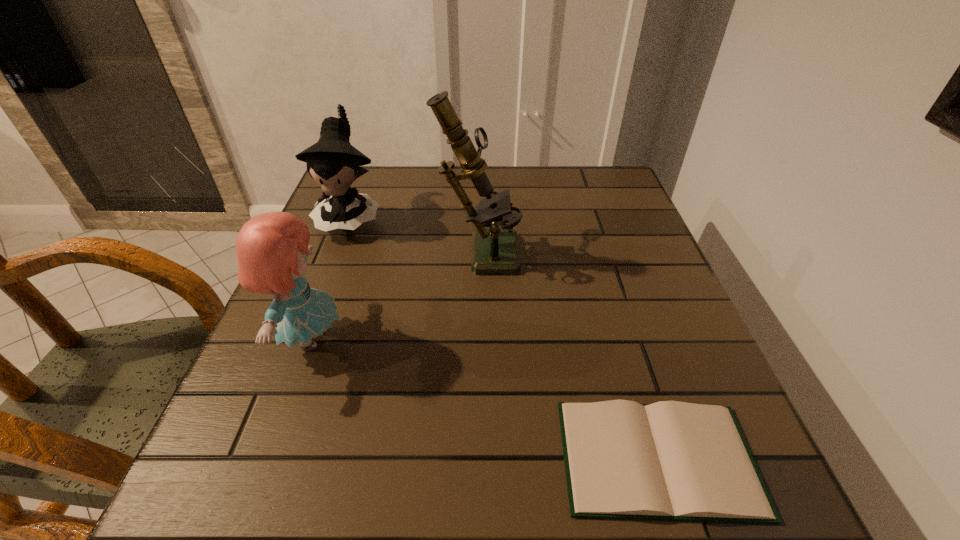
Identify the location of vacant space at the far right corner of the desktop. (582, 186).

The width and height of the screenshot is (960, 540). I want to click on free spot between the farther doll and the second object from right to left, so click(415, 233).

The image size is (960, 540). I want to click on vacant area that lies between the microscope and the shortest object, so (x=567, y=354).

The image size is (960, 540). Find the location of `free space that is in between the hardback book and the farther doll`. free space that is in between the hardback book and the farther doll is located at coordinates (504, 338).

In order to click on vacant region between the third farthest object and the tallest object in this screenshot , I will do `click(395, 294)`.

At what (x,y) coordinates should I click in order to perform the action: click on free space between the microscope and the farther doll. Please return your answer as a coordinate pair (x, y). The width and height of the screenshot is (960, 540). Looking at the image, I should click on (415, 233).

Identify the location of unoccupied area between the third farthest object and the shortest object. (484, 399).

Locate an element on the screen. The width and height of the screenshot is (960, 540). vacant area that lies between the farther doll and the tallest object is located at coordinates (415, 233).

The height and width of the screenshot is (540, 960). I want to click on free point between the farther doll and the nearer doll, so click(x=330, y=278).

Find the location of a particular element. The height and width of the screenshot is (540, 960). vacant point located between the nearer doll and the nearest object is located at coordinates (484, 399).